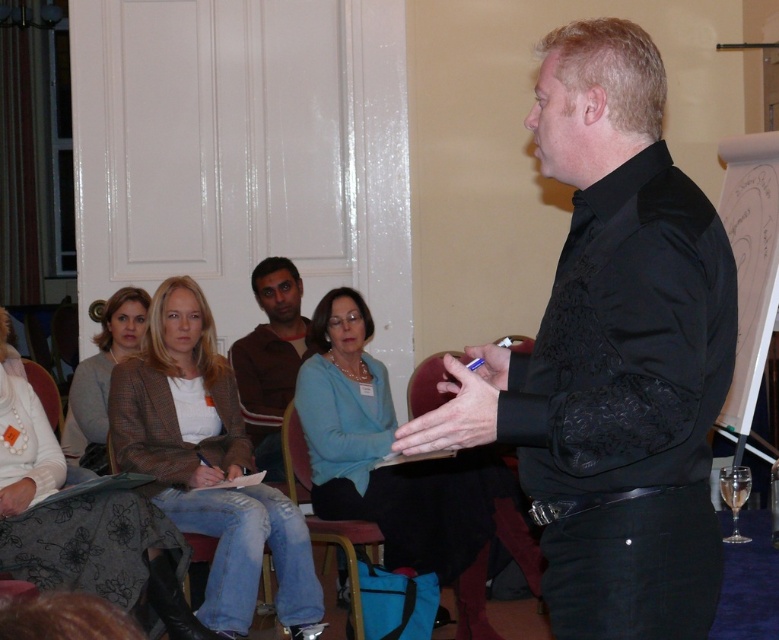
You are organizing a clothing display and need to place the black satin shirt at center and the brown sweater at center on a mannequin. Which clothing item should you put on the mannequin first to ensure proper layering?

The black satin shirt at center should be placed on the mannequin first because it is larger in size than the brown sweater at center, allowing the smaller sweater to be layered over it appropriately.

You are standing in the room and see two points marked in the image. Which point is nearer to you, point (717, 269) or point (62, 442)?

Point (717, 269) is closer to the viewer than point (62, 442).

You are an attendee at the presentation. You notice the black satin shirt at center and the brown sweater at center. Which one is positioned higher in the image?

The black satin shirt at center is located above the brown sweater at center, so it is positioned higher in the image.